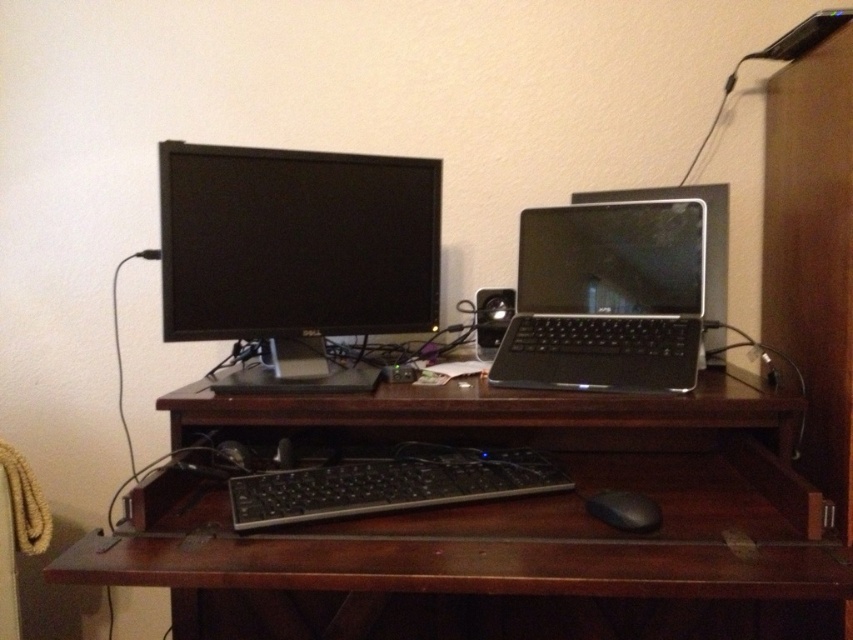
Consider the image. Who is more distant from viewer, (607, 557) or (666, 248)?

The point (666, 248) is behind.

Where is `dark wood table at center`? dark wood table at center is located at coordinates (480, 506).

The width and height of the screenshot is (853, 640). What are the coordinates of `dark wood table at center` in the screenshot? It's located at (480, 506).

Who is more forward, [363,516] or [270,148]?

Point [363,516]

Can you confirm if dark wood table at center is bigger than matte black monitor at center?

Yes, dark wood table at center is bigger than matte black monitor at center.

Which is in front, point (369, 445) or point (248, 179)?

Positioned in front is point (248, 179).

This screenshot has height=640, width=853. I want to click on dark wood table at center, so click(x=480, y=506).

Between matte black monitor at center and black plastic keyboard at center, which one appears on the left side from the viewer's perspective?

matte black monitor at center

Is point (231, 234) in front of point (538, 465)?

Yes, point (231, 234) is in front of point (538, 465).

Is point (225, 387) in front of point (234, 492)?

No, (225, 387) is behind (234, 492).

I want to click on matte black monitor at center, so click(x=296, y=253).